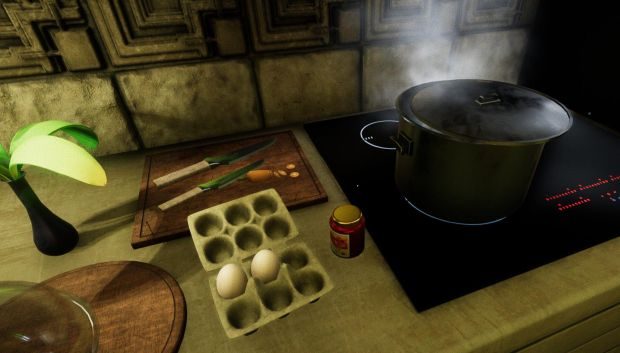
Image resolution: width=620 pixels, height=353 pixels. I want to click on cutting board, so click(x=164, y=225).